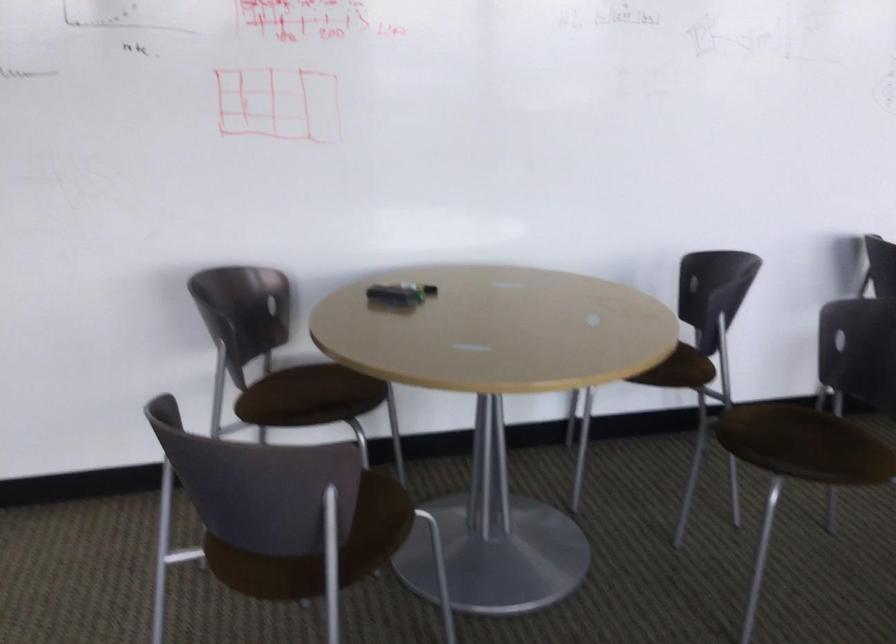
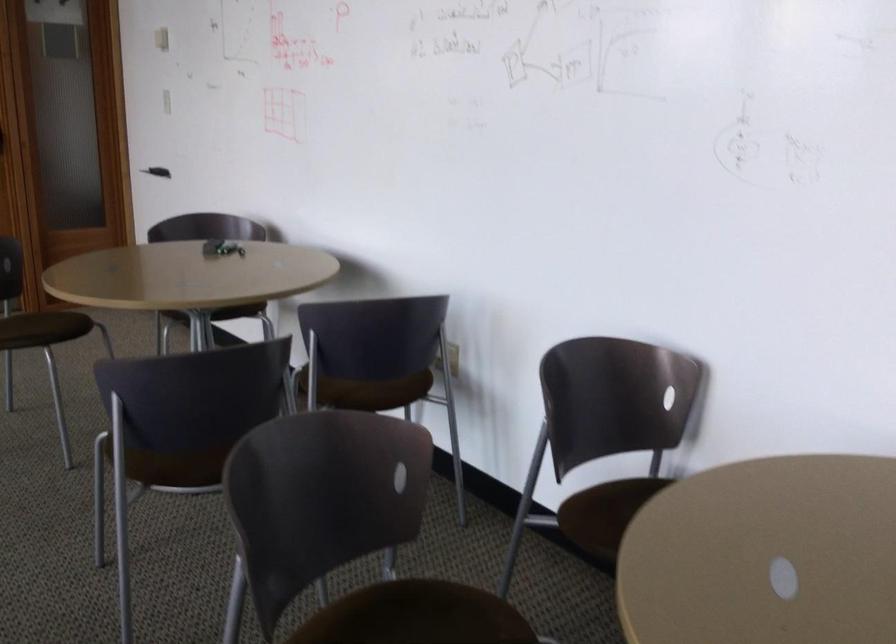
In the second image, find the point that corresponds to [362,516] in the first image.

(44, 328)